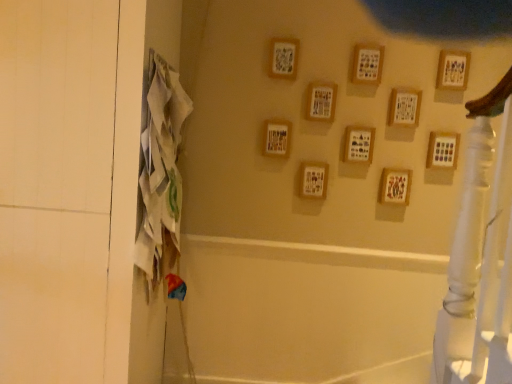
Question: From a real-world perspective, is wooden frame at upper center, arranged as the 9th picture frame when viewed from the right, under wooden picture frame at right, which is the second picture frame in right-to-left order?

Choices:
 (A) no
 (B) yes

Answer: (A)

Question: Is wooden frame at upper center, which is the second picture frame in left-to-right order, wider than wooden picture frame at right, the ninth picture frame in the left-to-right sequence?

Choices:
 (A) no
 (B) yes

Answer: (A)

Question: Does wooden frame at upper center, arranged as the 9th picture frame when viewed from the right, turn towards wooden picture frame at right, which is the second picture frame in right-to-left order?

Choices:
 (A) yes
 (B) no

Answer: (B)

Question: Does wooden frame at upper center, which is the second picture frame in left-to-right order, have a larger size compared to wooden picture frame at right, the ninth picture frame in the left-to-right sequence?

Choices:
 (A) no
 (B) yes

Answer: (A)

Question: Does wooden frame at upper center, arranged as the 9th picture frame when viewed from the right, appear on the left side of wooden picture frame at right, the ninth picture frame in the left-to-right sequence?

Choices:
 (A) no
 (B) yes

Answer: (B)

Question: Can you confirm if wooden frame at upper center, arranged as the 9th picture frame when viewed from the right, is taller than wooden picture frame at right, the ninth picture frame in the left-to-right sequence?

Choices:
 (A) yes
 (B) no

Answer: (A)

Question: Considering the relative sizes of wooden picture frame at upper right, the first picture frame viewed from the right, and wooden frame at upper center, arranged as the 9th picture frame when viewed from the right, in the image provided, is wooden picture frame at upper right, the first picture frame viewed from the right, wider than wooden frame at upper center, arranged as the 9th picture frame when viewed from the right,?

Choices:
 (A) yes
 (B) no

Answer: (A)

Question: From a real-world perspective, is wooden picture frame at upper right, the first picture frame viewed from the right, located higher than wooden frame at upper center, which is the second picture frame in left-to-right order?

Choices:
 (A) yes
 (B) no

Answer: (B)

Question: Does wooden picture frame at upper right, the first picture frame viewed from the right, have a larger size compared to wooden frame at upper center, which is the second picture frame in left-to-right order?

Choices:
 (A) no
 (B) yes

Answer: (A)

Question: Can you confirm if wooden picture frame at upper right, arranged as the 10th picture frame when viewed from the left, is taller than wooden frame at upper center, arranged as the 9th picture frame when viewed from the right?

Choices:
 (A) yes
 (B) no

Answer: (B)

Question: Is wooden picture frame at upper right, the first picture frame viewed from the right, smaller than wooden frame at upper center, which is the second picture frame in left-to-right order?

Choices:
 (A) yes
 (B) no

Answer: (A)

Question: Could wooden frame at upper center, which is the second picture frame in left-to-right order, be considered to be inside wooden picture frame at upper right, the first picture frame viewed from the right?

Choices:
 (A) yes
 (B) no

Answer: (B)

Question: From the image's perspective, would you say white fabric screen door at left is shown under wooden frame at center, which appears as the 8th picture frame when viewed from the right?

Choices:
 (A) no
 (B) yes

Answer: (B)